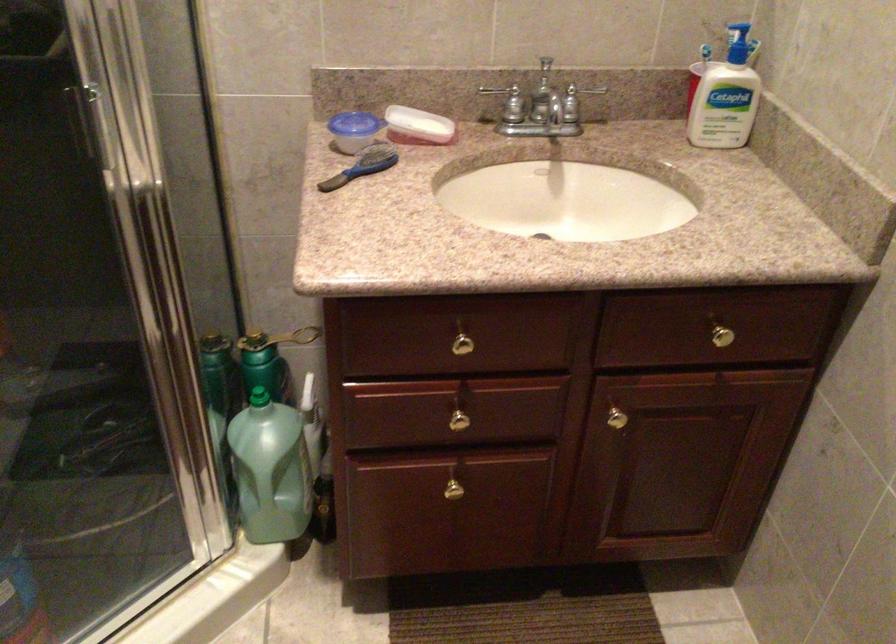
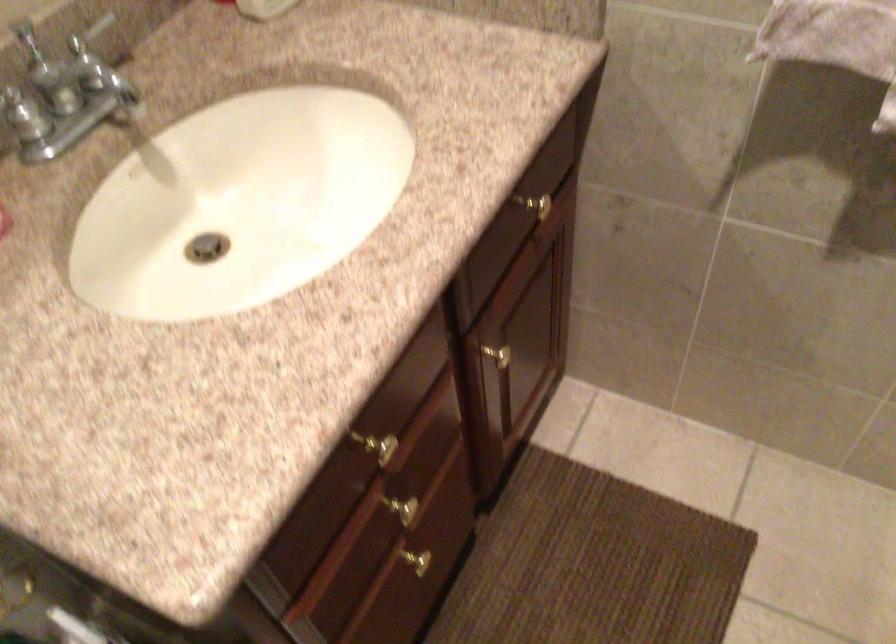
First-person continuous shooting, in which direction is the camera rotating?

The rotation direction of the camera is right-down.